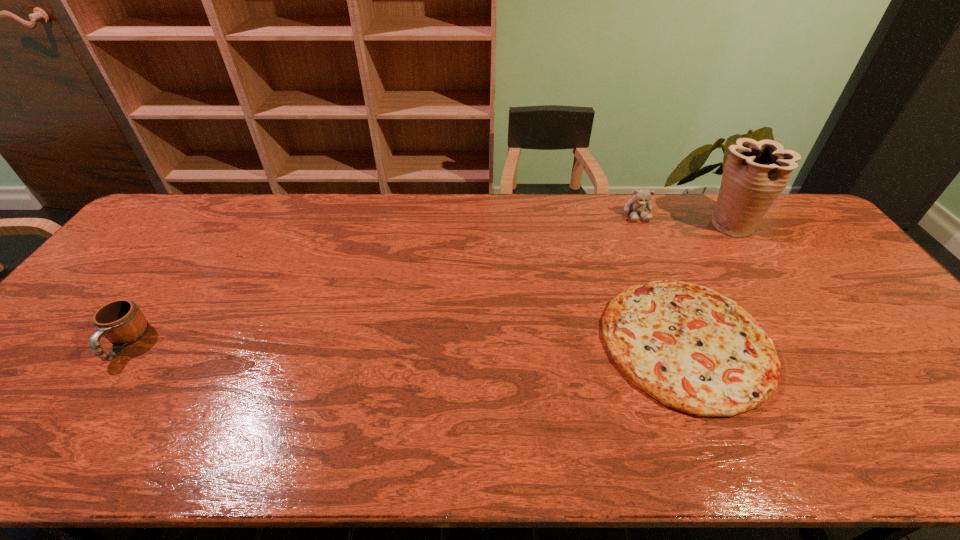
You are a GUI agent. You are given a task and a screenshot of the screen. Output one action in this format:
    pyautogui.click(x=<x>, y=<y>)
    Task: Click on the free spot between the second tallest object and the tallest object
    
    Given the screenshot: What is the action you would take?
    pyautogui.click(x=684, y=219)

This screenshot has width=960, height=540. In order to click on empty space that is in between the pizza and the teddy bear in this screenshot , I will do (x=661, y=278).

Image resolution: width=960 pixels, height=540 pixels. In order to click on unoccupied position between the second tallest object and the rightmost object in this screenshot , I will do [684, 219].

The height and width of the screenshot is (540, 960). Identify the location of free area in between the rightmost object and the leftmost object. point(428,284).

The height and width of the screenshot is (540, 960). What are the coordinates of `free area in between the leftmost object and the shortest object` in the screenshot? It's located at (406, 342).

I want to click on unoccupied position between the pizza and the rightmost object, so click(x=708, y=283).

Locate an element on the screen. The height and width of the screenshot is (540, 960). object that ranks as the third closest to the tallest object is located at coordinates (122, 322).

Identify which object is the closest to the leftmost object. Please provide its 2D coordinates. Your answer should be formatted as a tuple, i.e. [(x, y)], where the tuple contains the x and y coordinates of a point satisfying the conditions above.

[(691, 348)]

Locate an element on the screen. The height and width of the screenshot is (540, 960). free space that satisfies the following two spatial constraints: 1. on the face of the rightmost object; 2. on the right side of the third shortest object is located at coordinates (640, 224).

Locate an element on the screen. The height and width of the screenshot is (540, 960). free space that satisfies the following two spatial constraints: 1. on the face of the teddy bear; 2. on the left side of the rightmost object is located at coordinates (640, 224).